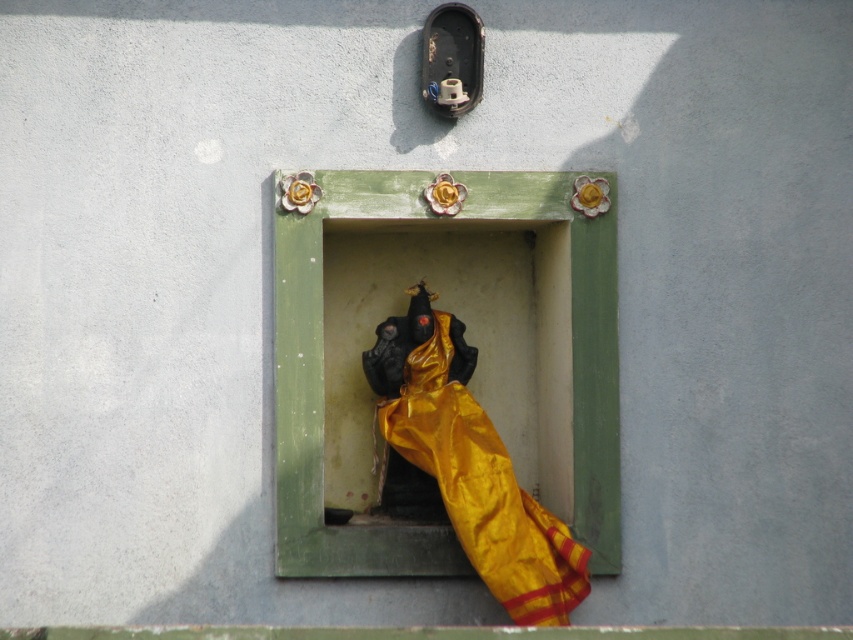
Who is higher up, green painted wood at center or gold silk cloth at center?

green painted wood at center is higher up.

Describe the element at coordinates (537, 365) in the screenshot. I see `green painted wood at center` at that location.

I want to click on green painted wood at center, so click(x=537, y=365).